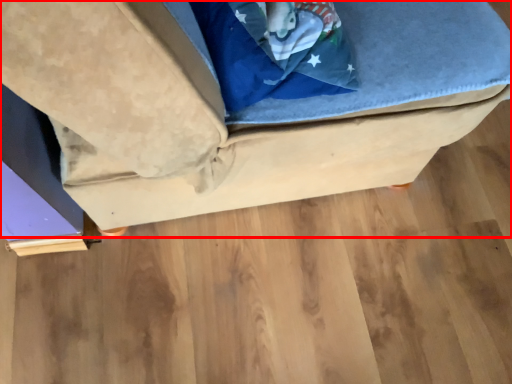
Question: From the image's perspective, considering the relative positions of furniture (annotated by the red box) and wood in the image provided, where is furniture (annotated by the red box) located with respect to the staircase?

Choices:
 (A) above
 (B) below

Answer: (A)